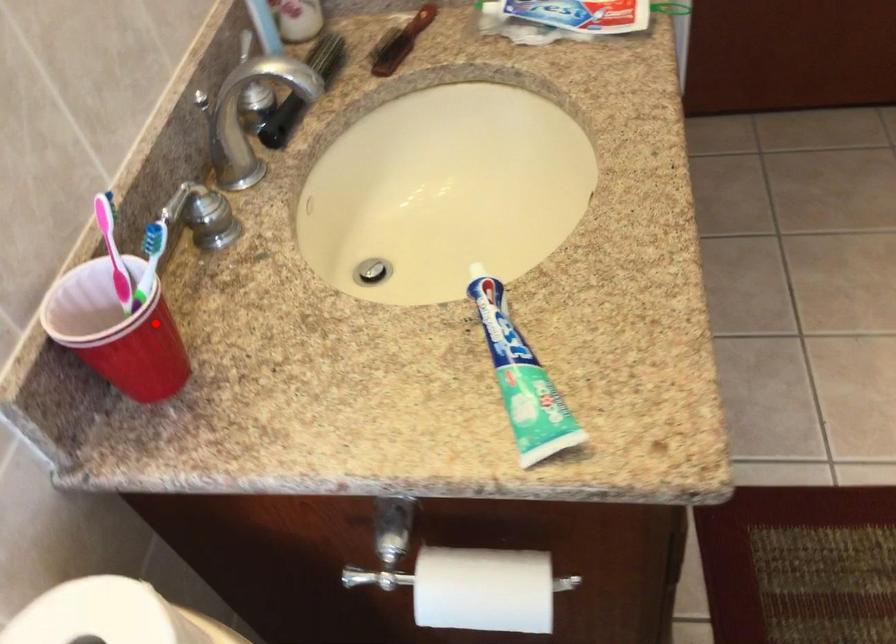
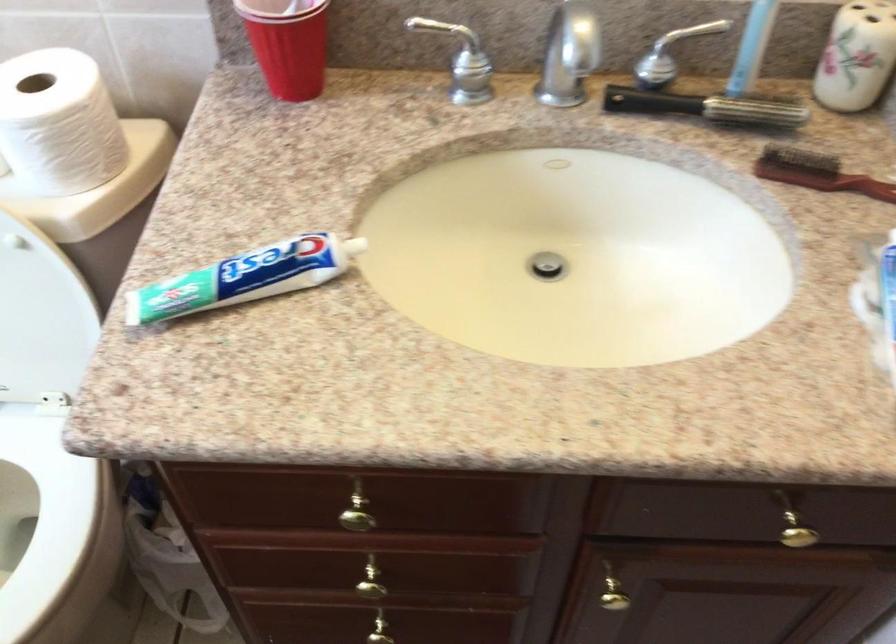
In the second image, find the point that corresponds to the highlighted location in the first image.

(288, 44)